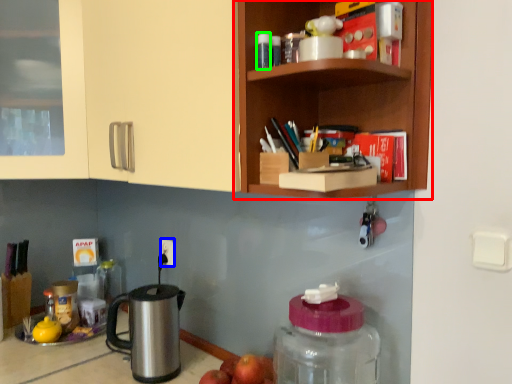
Question: Considering the real-world distances, which object is farthest from shelf (highlighted by a red box)? electric outlet (highlighted by a blue box) or bottle (highlighted by a green box)?

Choices:
 (A) electric outlet
 (B) bottle

Answer: (A)